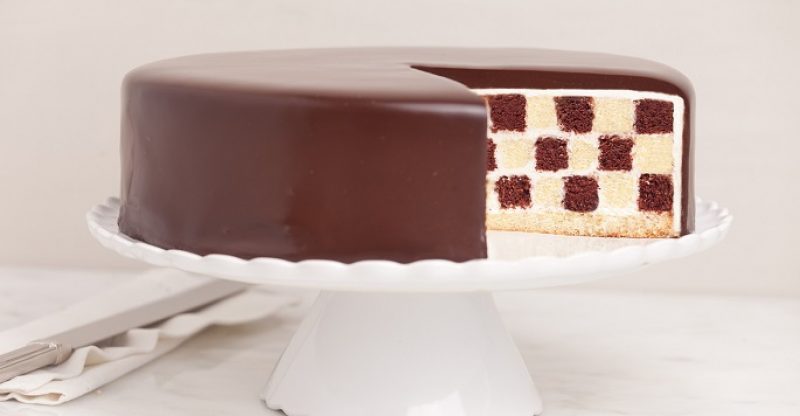
Locate an element on the screen. cake serving knife on top of napkin is located at coordinates (122, 302).